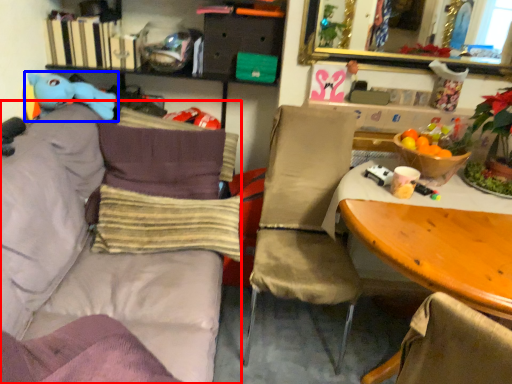
Question: Which object appears closest to the camera in this image, studio couch (highlighted by a red box) or toy (highlighted by a blue box)?

Choices:
 (A) studio couch
 (B) toy

Answer: (A)